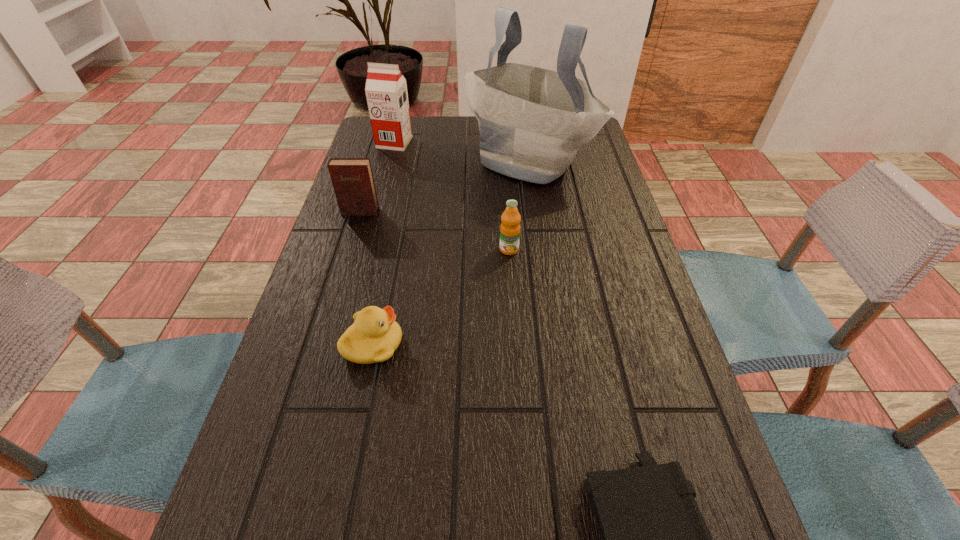
What are the coordinates of `free location at the left edge of the desktop` in the screenshot? It's located at (282, 531).

Find the location of a particular element. vacant region at the right edge is located at coordinates (615, 256).

In the image, there is a desktop. Where is `vacant area at the far left corner`? vacant area at the far left corner is located at coordinates (379, 152).

The height and width of the screenshot is (540, 960). I want to click on free space between the soya milk and the diary, so click(x=377, y=177).

Find the location of `free spot between the second tallest object and the fourth farthest object`. free spot between the second tallest object and the fourth farthest object is located at coordinates (452, 196).

At what (x,y) coordinates should I click in order to perform the action: click on free spot between the fifth shortest object and the diary. Please return your answer as a coordinate pair (x, y). This screenshot has width=960, height=540. Looking at the image, I should click on (377, 177).

You are a GUI agent. You are given a task and a screenshot of the screen. Output one action in this format:
    pyautogui.click(x=<x>, y=<y>)
    Task: Click on the free space between the fourth nearest object and the soya milk
    This screenshot has width=960, height=540.
    Given the screenshot: What is the action you would take?
    pyautogui.click(x=377, y=177)

The height and width of the screenshot is (540, 960). In order to click on vacant area that lies between the orange juice and the duckling in this screenshot , I will do `click(441, 297)`.

At what (x,y) coordinates should I click in order to perform the action: click on vacant region between the fifth tallest object and the soya milk. Please return your answer as a coordinate pair (x, y). Looking at the image, I should click on (384, 244).

This screenshot has height=540, width=960. Identify the location of unoccupied position between the fifth tallest object and the soya milk. (384, 244).